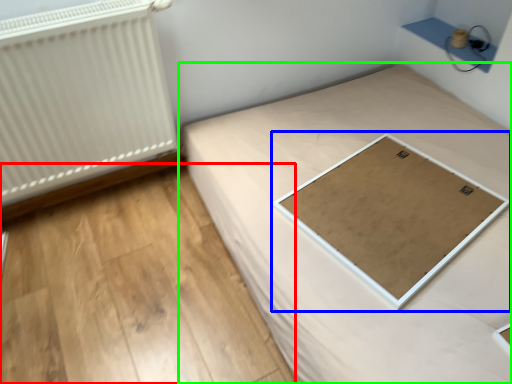
Question: Estimate the real-world distances between objects in this image. Which object is closer to plywood (highlighted by a red box), table (highlighted by a blue box) or bed (highlighted by a green box)?

Choices:
 (A) table
 (B) bed

Answer: (B)